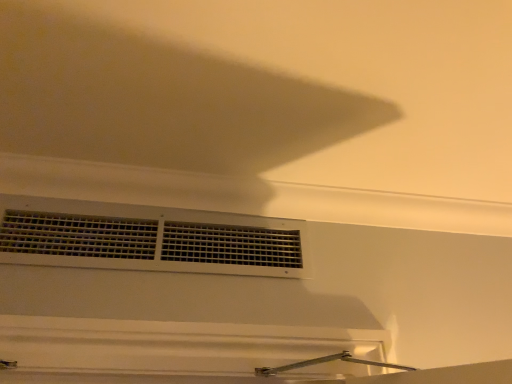
Question: Is white matte vent at center at the left side of white matte exhaust hood at upper center?

Choices:
 (A) no
 (B) yes

Answer: (B)

Question: Is white matte vent at center bigger than white matte exhaust hood at upper center?

Choices:
 (A) yes
 (B) no

Answer: (B)

Question: Is white matte vent at center facing towards white matte exhaust hood at upper center?

Choices:
 (A) no
 (B) yes

Answer: (A)

Question: Is white matte exhaust hood at upper center at the back of white matte vent at center?

Choices:
 (A) no
 (B) yes

Answer: (A)

Question: Is white matte exhaust hood at upper center completely or partially inside white matte vent at center?

Choices:
 (A) no
 (B) yes

Answer: (A)

Question: Is white matte vent at center in contact with white matte exhaust hood at upper center?

Choices:
 (A) yes
 (B) no

Answer: (B)

Question: Does white matte exhaust hood at upper center turn towards white matte vent at center?

Choices:
 (A) no
 (B) yes

Answer: (A)

Question: Does white matte exhaust hood at upper center have a larger size compared to white matte vent at center?

Choices:
 (A) no
 (B) yes

Answer: (B)

Question: From the image's perspective, is white matte exhaust hood at upper center on white matte vent at center?

Choices:
 (A) yes
 (B) no

Answer: (A)

Question: Can we say white matte exhaust hood at upper center lies outside white matte vent at center?

Choices:
 (A) no
 (B) yes

Answer: (B)

Question: From a real-world perspective, is white matte exhaust hood at upper center beneath white matte vent at center?

Choices:
 (A) yes
 (B) no

Answer: (B)

Question: Is white matte vent at center inside white matte exhaust hood at upper center?

Choices:
 (A) no
 (B) yes

Answer: (A)

Question: In the image, is white matte vent at center positioned in front of or behind white matte exhaust hood at upper center?

Choices:
 (A) behind
 (B) front

Answer: (A)